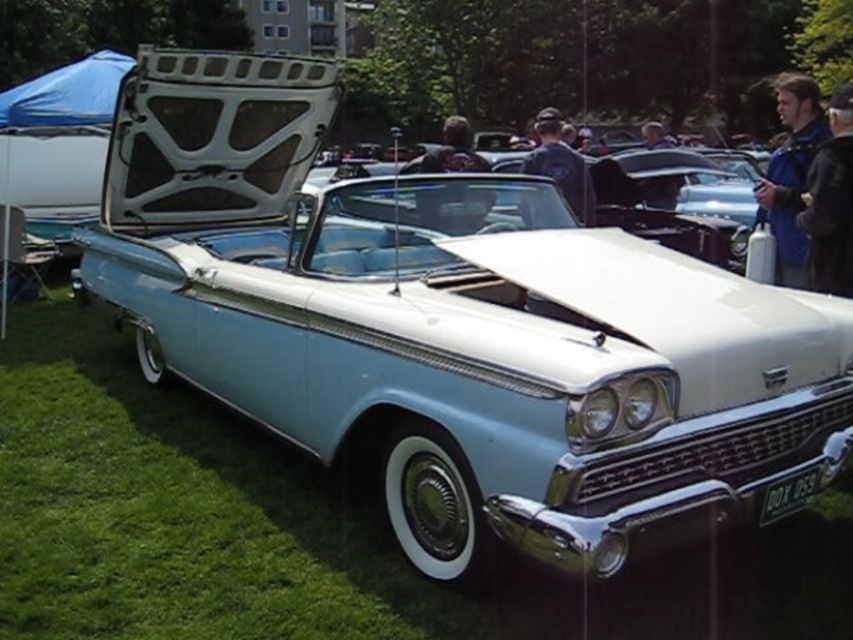
Between blue jacket at upper right and dark blue jacket at upper right, which one appears on the left side from the viewer's perspective?

Positioned to the left is dark blue jacket at upper right.

Can you confirm if blue jacket at upper right is smaller than dark blue jacket at upper right?

Incorrect, blue jacket at upper right is not smaller in size than dark blue jacket at upper right.

Does point (785, 81) come in front of point (809, 278)?

No, it is behind (809, 278).

At what (x,y) coordinates should I click in order to perform the action: click on blue jacket at upper right. Please return your answer as a coordinate pair (x, y). Looking at the image, I should click on (791, 173).

Who is higher up, dark blue jacket at upper right or dark blue uniform at center?

dark blue uniform at center is above.

Between point (846, 282) and point (582, 160), which one is positioned in front?

Positioned in front is point (846, 282).

This screenshot has width=853, height=640. I want to click on dark blue jacket at upper right, so click(x=830, y=202).

Can you confirm if blue jacket at upper right is thinner than dark blue uniform at center?

No.

Who is lower down, blue jacket at upper right or dark blue uniform at center?

blue jacket at upper right

Does point (778, 100) come closer to viewer compared to point (590, 200)?

No, it is not.

At what (x,y) coordinates should I click in order to perform the action: click on blue jacket at upper right. Please return your answer as a coordinate pair (x, y). Looking at the image, I should click on (791, 173).